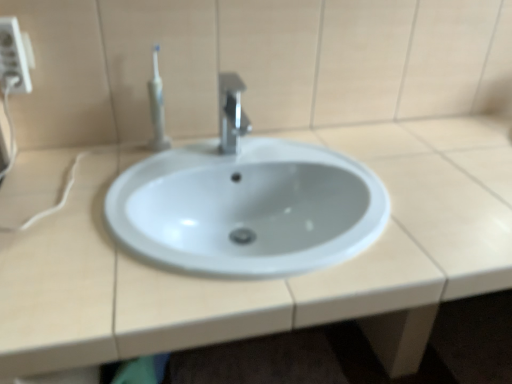
Image resolution: width=512 pixels, height=384 pixels. What do you see at coordinates (13, 57) in the screenshot? I see `white plastic electric outlet at upper left` at bounding box center [13, 57].

Describe the element at coordinates (273, 280) in the screenshot. I see `white glossy sink at center` at that location.

You are a GUI agent. You are given a task and a screenshot of the screen. Output one action in this format:
    pyautogui.click(x=<x>, y=<y>)
    Task: Click on the white glossy sink at center
    Image resolution: width=512 pixels, height=384 pixels.
    Given the screenshot: What is the action you would take?
    pyautogui.click(x=273, y=280)

Identify the location of white plastic toothbrush at upper left. (157, 107).

Describe the element at coordinates (157, 107) in the screenshot. This screenshot has height=384, width=512. I see `white plastic toothbrush at upper left` at that location.

Locate an element on the screen. polished metallic faucet at center is located at coordinates (231, 113).

Is white plastic toothbrush at upper left in front of or behind polished metallic faucet at center in the image?

white plastic toothbrush at upper left is positioned farther from the viewer than polished metallic faucet at center.

Considering the relative positions of white plastic toothbrush at upper left and polished metallic faucet at center in the image provided, is white plastic toothbrush at upper left to the left of polished metallic faucet at center from the viewer's perspective?

Correct, you'll find white plastic toothbrush at upper left to the left of polished metallic faucet at center.

Between point (163, 142) and point (244, 125), which one is positioned behind?

The point (244, 125) is farther from the camera.

How different are the orientations of white plastic toothbrush at upper left and polished metallic faucet at center in degrees?

The angle between the facing direction of white plastic toothbrush at upper left and the facing direction of polished metallic faucet at center is 1.88 degrees.

From the image's perspective, is white plastic toothbrush at upper left on white glossy sink at center?

Yes, from the image's perspective, white plastic toothbrush at upper left is on top of white glossy sink at center.

How different are the orientations of white plastic toothbrush at upper left and white glossy sink at center in degrees?

The facing directions of white plastic toothbrush at upper left and white glossy sink at center are 0.689 degrees apart.

Which is in front, white plastic toothbrush at upper left or white glossy sink at center?

white glossy sink at center is closer to the camera.

Looking at their sizes, would you say white plastic toothbrush at upper left is wider or thinner than white glossy sink at center?

Clearly, white plastic toothbrush at upper left has less width compared to white glossy sink at center.

Does white plastic electric outlet at upper left appear on the left side of white plastic toothbrush at upper left?

Yes, white plastic electric outlet at upper left is to the left of white plastic toothbrush at upper left.

Measure the distance from white plastic electric outlet at upper left to white plastic toothbrush at upper left.

They are 27.93 centimeters apart.

In the image, there is a white plastic toothbrush at upper left. At what (x,y) coordinates should I click in order to perform the action: click on electric outlet above it (from the image's perspective). Please return your answer as a coordinate pair (x, y). The image size is (512, 384). Looking at the image, I should click on (13, 57).

Is white plastic electric outlet at upper left located outside white plastic toothbrush at upper left?

white plastic electric outlet at upper left is positioned outside white plastic toothbrush at upper left.

From a real-world perspective, who is located higher, white plastic electric outlet at upper left or polished metallic faucet at center?

In real-world perspective, white plastic electric outlet at upper left is above.

Is white plastic electric outlet at upper left facing towards polished metallic faucet at center?

No, white plastic electric outlet at upper left is not facing towards polished metallic faucet at center.

Find the location of a particular element. electric outlet that appears on the left of polished metallic faucet at center is located at coordinates (13, 57).

Between white plastic electric outlet at upper left and polished metallic faucet at center, which one has larger size?

polished metallic faucet at center is bigger.

Is white glossy sink at center aimed at white plastic electric outlet at upper left?

No, white glossy sink at center is not turned towards white plastic electric outlet at upper left.

Does white glossy sink at center have a greater width compared to white plastic electric outlet at upper left?

Yes, white glossy sink at center is wider than white plastic electric outlet at upper left.

Does point (7, 266) appear closer or farther from the camera than point (12, 26)?

Point (7, 266) is closer to the camera than point (12, 26).

In terms of size, does white glossy sink at center appear bigger or smaller than white plastic electric outlet at upper left?

white glossy sink at center is bigger than white plastic electric outlet at upper left.

From the image's perspective, is white plastic electric outlet at upper left beneath white glossy sink at center?

No, from the image's perspective, white plastic electric outlet at upper left is not beneath white glossy sink at center.

Considering the sizes of objects white plastic electric outlet at upper left and white glossy sink at center in the image provided, who is wider, white plastic electric outlet at upper left or white glossy sink at center?

white glossy sink at center.

Which is correct: white plastic electric outlet at upper left is inside white glossy sink at center, or outside of it?

white plastic electric outlet at upper left lies outside white glossy sink at center.

Considering the sizes of objects white plastic electric outlet at upper left and white glossy sink at center in the image provided, who is bigger, white plastic electric outlet at upper left or white glossy sink at center?

white glossy sink at center.

Is polished metallic faucet at center completely or partially outside of white plastic electric outlet at upper left?

That's correct, polished metallic faucet at center is outside of white plastic electric outlet at upper left.

Does polished metallic faucet at center touch white plastic electric outlet at upper left?

polished metallic faucet at center and white plastic electric outlet at upper left are not in contact.

Locate an element on the screen. tap behind the white plastic electric outlet at upper left is located at coordinates (231, 113).

Which object is thinner, polished metallic faucet at center or white plastic electric outlet at upper left?

Thinner between the two is white plastic electric outlet at upper left.

Identify the location of toothbrush above the polished metallic faucet at center (from the image's perspective). (157, 107).

Find the location of a particular element. The image size is (512, 384). toothbrush above the white glossy sink at center (from a real-world perspective) is located at coordinates (157, 107).

From the image, which object appears to be farther from white plastic toothbrush at upper left, white plastic electric outlet at upper left or white glossy sink at center?

white glossy sink at center is positioned further to the anchor white plastic toothbrush at upper left.

In the scene shown: Estimate the real-world distances between objects in this image. Which object is further from polished metallic faucet at center, white plastic electric outlet at upper left or white glossy sink at center?

Among the two, white plastic electric outlet at upper left is located further to polished metallic faucet at center.

Consider the image. Which object lies nearer to the anchor point polished metallic faucet at center, white plastic electric outlet at upper left or white plastic toothbrush at upper left?

white plastic toothbrush at upper left is positioned closer to the anchor polished metallic faucet at center.

Estimate the real-world distances between objects in this image. Which object is further from white plastic electric outlet at upper left, white plastic toothbrush at upper left or white glossy sink at center?

white glossy sink at center is positioned further to the anchor white plastic electric outlet at upper left.

When comparing their distances from polished metallic faucet at center, does white plastic toothbrush at upper left or white plastic electric outlet at upper left seem closer?

Among the two, white plastic toothbrush at upper left is located nearer to polished metallic faucet at center.

Based on their spatial positions, is white plastic toothbrush at upper left or polished metallic faucet at center further from white plastic electric outlet at upper left?

polished metallic faucet at center is further to white plastic electric outlet at upper left.

Considering their positions, is polished metallic faucet at center positioned further to white glossy sink at center than white plastic toothbrush at upper left?

white plastic toothbrush at upper left lies further to white glossy sink at center than the other object.

Which object lies further to the anchor point white plastic electric outlet at upper left, white glossy sink at center or white plastic toothbrush at upper left?

A: white glossy sink at center is positioned further to the anchor white plastic electric outlet at upper left.

The width and height of the screenshot is (512, 384). I want to click on toothbrush between white plastic electric outlet at upper left and polished metallic faucet at center, so click(157, 107).

Where is `toothbrush between white plastic electric outlet at upper left and white glossy sink at center`? This screenshot has height=384, width=512. toothbrush between white plastic electric outlet at upper left and white glossy sink at center is located at coordinates (157, 107).

Find the location of a particular element. This screenshot has width=512, height=384. tap between white plastic electric outlet at upper left and white glossy sink at center in the horizontal direction is located at coordinates (231, 113).

In order to click on tap between white plastic toothbrush at upper left and white glossy sink at center in the vertical direction in this screenshot , I will do `click(231, 113)`.